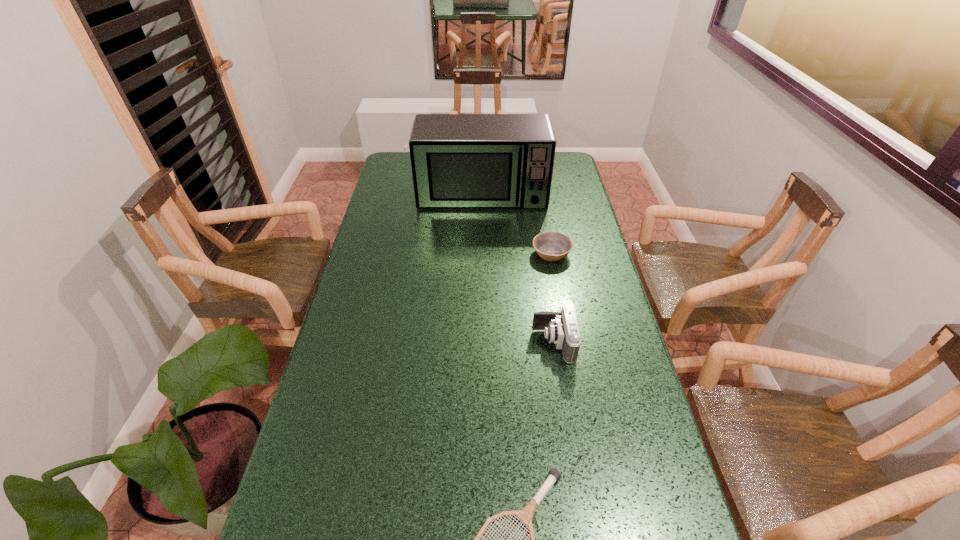
Identify the location of vacant space located 0.250m on the left of the second shortest object. (461, 253).

Where is `object present at the far edge`? object present at the far edge is located at coordinates (458, 160).

Locate an element on the screen. The height and width of the screenshot is (540, 960). microwave_oven situated at the right edge is located at coordinates (458, 160).

This screenshot has width=960, height=540. I want to click on camera that is at the right edge, so click(562, 329).

The image size is (960, 540). I want to click on bowl that is at the right edge, so click(551, 246).

The width and height of the screenshot is (960, 540). Identify the location of object that is at the far right corner. (458, 160).

Locate an element on the screen. This screenshot has height=540, width=960. free space at the left edge of the desktop is located at coordinates (396, 179).

Where is `free spot at the right edge of the desktop`? free spot at the right edge of the desktop is located at coordinates (586, 245).

This screenshot has width=960, height=540. Identify the location of vacant space that is in between the bowl and the second nearest object. (552, 298).

At what (x,y) coordinates should I click in order to perform the action: click on free space between the third nearest object and the camera. Please return your answer as a coordinate pair (x, y). Looking at the image, I should click on (552, 298).